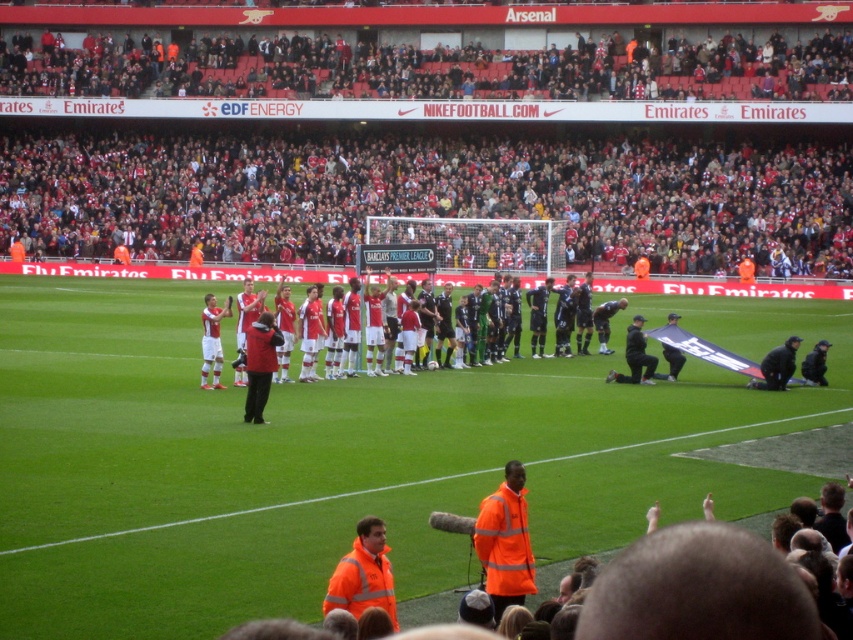
You are a photographer standing at the point marked as point (619, 376). You want to take a photo of both groups of players. Since you have a camera with a 50mm lens, which has a field of view of 46 degrees, can you fit both groups into a single photo without moving? Please consider their distance apart and your position.

The two groups of players are 27.57 meters apart. With a 50mm lens providing a 46 degree field of view, the maximum distance that can be captured in the frame is approximately 27.57 meters. Since the distance between the groups matches the field of view, it is possible to fit both groups into a single photo without moving.

You are a photographer at the stadium and want to capture a photo that includes both the red fabric crowd at upper center and the high visibility jacket at center. Which object should you focus on first to ensure both are in the frame?

The red fabric crowd at upper center is positioned over the high visibility jacket at center, so you should focus on the high visibility jacket at center first to ensure both are in the frame.

From the picture: You are a photographer standing at the edge of the pitch. You want to take a photo of both the black leather jacket at center and the black fabric jacket at lower right in the same frame. The minimum distance between them is 6.27 feet. If your camera has a 50mm lens, which has a field of view of about 46 degrees, can you fit both jackets into the frame from your current position?

The black leather jacket at center and the black fabric jacket at lower right are 6.27 feet apart. With a 50mm lens providing a 46 degree field of view, the maximum distance you can be from the jackets to capture both in frame would depend on the angle. However, since you are already at the edge of the pitch, it is likely possible to fit both jackets into the frame as 6.27 feet within a 46 degree angle is manageable with proper framing.